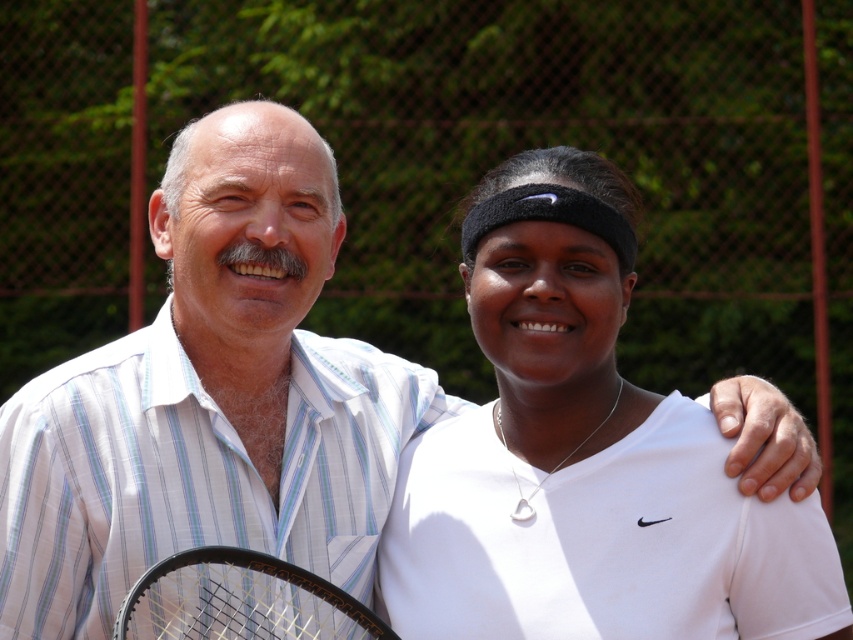
Question: Which point appears closest to the camera in this image?

Choices:
 (A) (564, 337)
 (B) (238, 577)

Answer: (A)

Question: Can you confirm if white matte tennis racket at center is bigger than black mesh racket at lower left?

Choices:
 (A) yes
 (B) no

Answer: (A)

Question: Which of the following is the farthest from the observer?

Choices:
 (A) (541, 292)
 (B) (335, 614)

Answer: (B)

Question: Does white matte tennis racket at center have a greater width compared to black mesh racket at lower left?

Choices:
 (A) no
 (B) yes

Answer: (B)

Question: Is the position of white matte tennis racket at center more distant than that of black mesh racket at lower left?

Choices:
 (A) yes
 (B) no

Answer: (A)